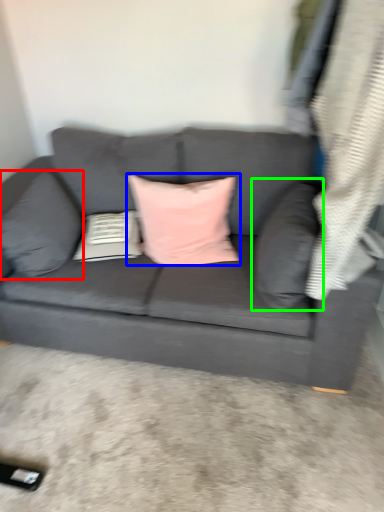
Question: Considering the real-world distances, which object is farthest from pillow (highlighted by a red box)? pillow (highlighted by a blue box) or pillow (highlighted by a green box)?

Choices:
 (A) pillow
 (B) pillow

Answer: (B)